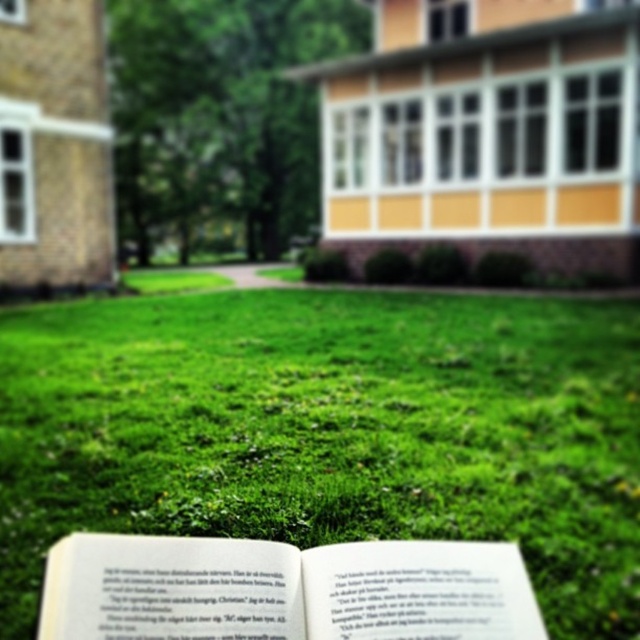
Does green grass at center have a greater height compared to white paper book at center?

Yes, green grass at center is taller than white paper book at center.

Does point (218, 355) lie in front of point (164, 563)?

No, it is not.

Where is `green grass at center`? Image resolution: width=640 pixels, height=640 pixels. green grass at center is located at coordinates (330, 429).